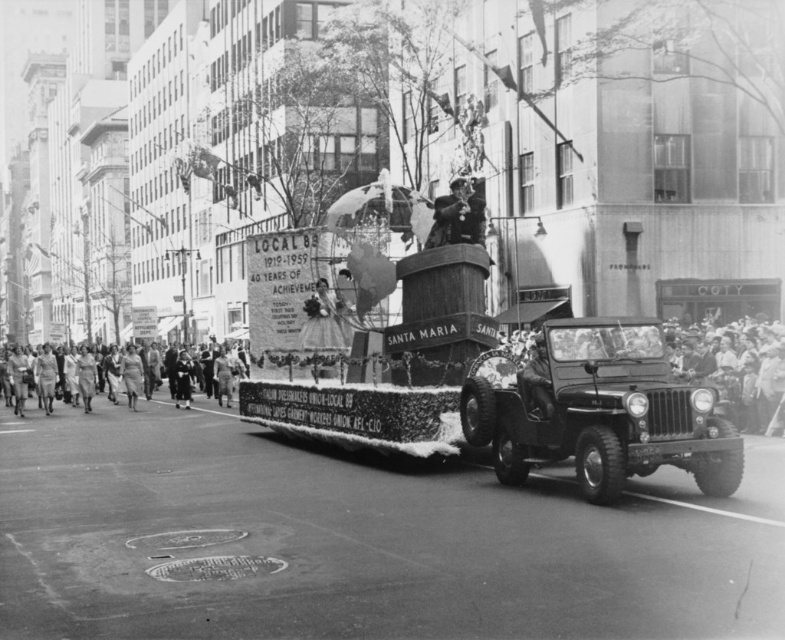
Question: Which point is farther to the camera?

Choices:
 (A) smooth leather hat at center
 (B) smooth beige dress at center
 (C) smooth black suit at center

Answer: (B)

Question: Which point appears closest to the camera in this image?

Choices:
 (A) (188, 401)
 (B) (327, 321)
 (C) (466, 232)
 (D) (123, 371)

Answer: (C)

Question: Among these objects, which one is nearest to the camera?

Choices:
 (A) smooth beige dress at center
 (B) white fabric sign at center

Answer: (B)

Question: Does smooth black suit at center appear on the left side of smooth beige dress at center?

Choices:
 (A) no
 (B) yes

Answer: (A)

Question: Where is metallic matte jeep at center located in relation to smooth fabric dress at center in the image?

Choices:
 (A) above
 (B) below

Answer: (A)

Question: Is smooth black suit at center closer to camera compared to smooth beige dress at center?

Choices:
 (A) yes
 (B) no

Answer: (A)